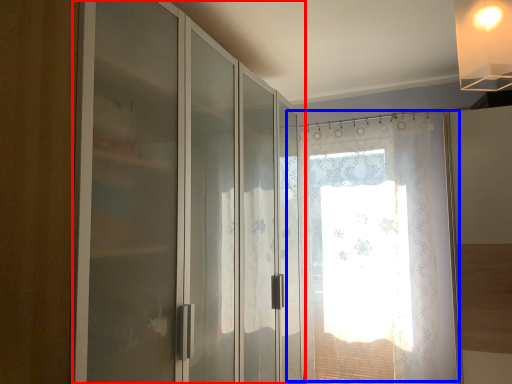
Question: Which object appears closest to the camera in this image, door (highlighted by a red box) or window (highlighted by a blue box)?

Choices:
 (A) door
 (B) window

Answer: (A)